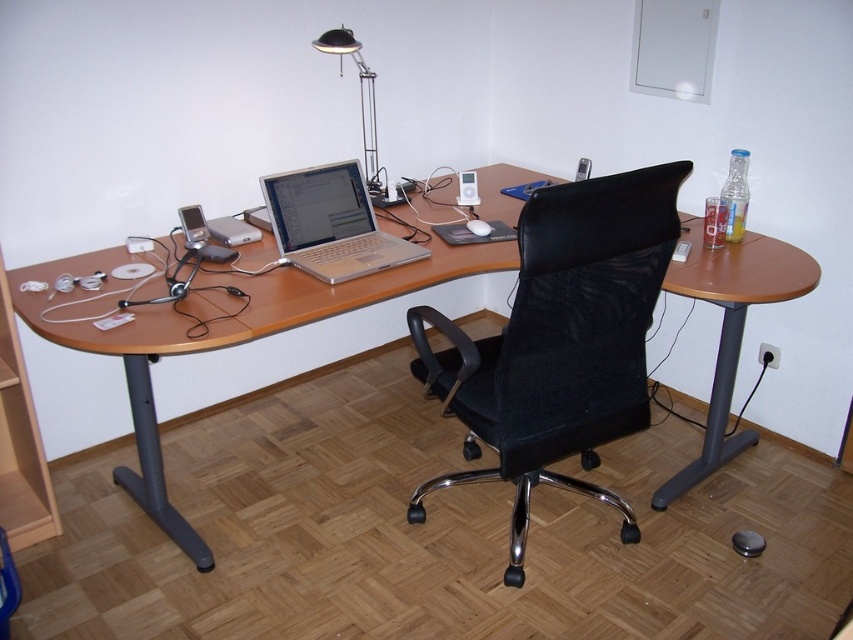
You are standing at the entrance of the home office and want to sit down at the desk. Where is the black mesh swivel chair at center located in relation to your current position?

The black mesh swivel chair at center is located at point 0.534 on the x axis and 0.659 on the y axis relative to the image frame.